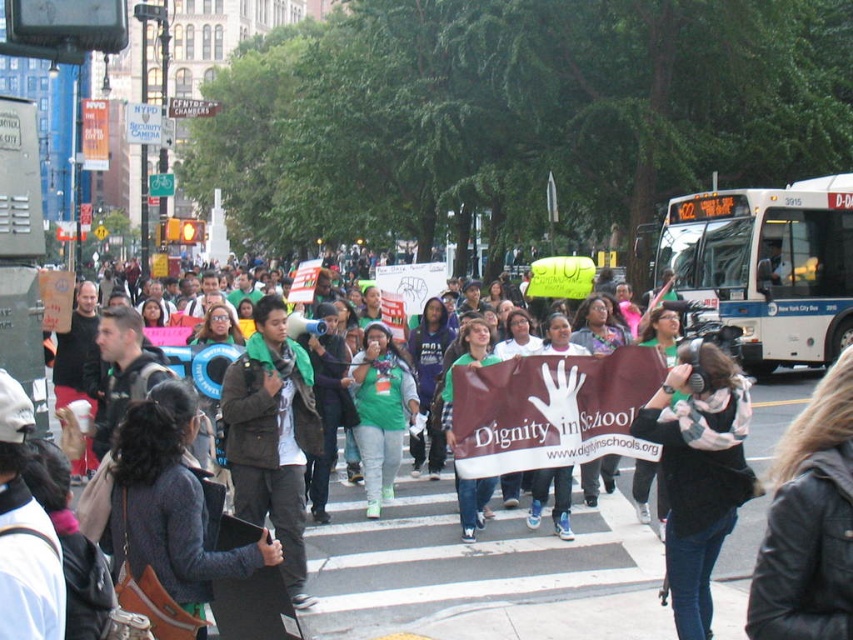
Question: Which point appears farthest from the camera in this image?

Choices:
 (A) (672, 588)
 (B) (268, 358)
 (C) (354, 358)
 (D) (758, 312)

Answer: (D)

Question: Can you confirm if white/blue metallic bus at upper right is smaller than flannel shirt at center?

Choices:
 (A) no
 (B) yes

Answer: (A)

Question: Can you confirm if flannel shirt at center is positioned below green matte jacket at center?

Choices:
 (A) no
 (B) yes

Answer: (B)

Question: Which object is closer to the camera taking this photo?

Choices:
 (A) brown leather jacket at center
 (B) white/blue metallic bus at upper right
 (C) green matte jacket at center

Answer: (A)

Question: Based on their relative distances, which object is farther from the brown leather jacket at center?

Choices:
 (A) flannel shirt at center
 (B) white/blue metallic bus at upper right
 (C) green matte jacket at center

Answer: (B)

Question: Is flannel shirt at center above brown leather jacket at center?

Choices:
 (A) yes
 (B) no

Answer: (B)